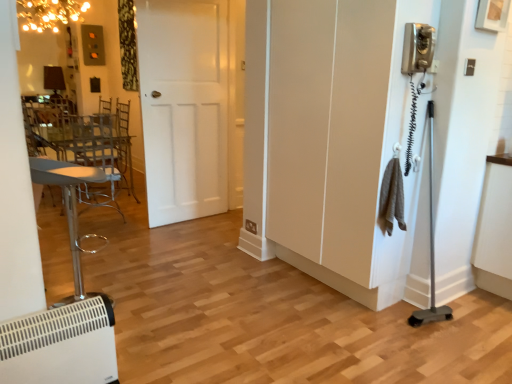
Locate an element on the screen. The height and width of the screenshot is (384, 512). vacant area that lies between white plastic heater at lower left and white matte screen door at right is located at coordinates (230, 301).